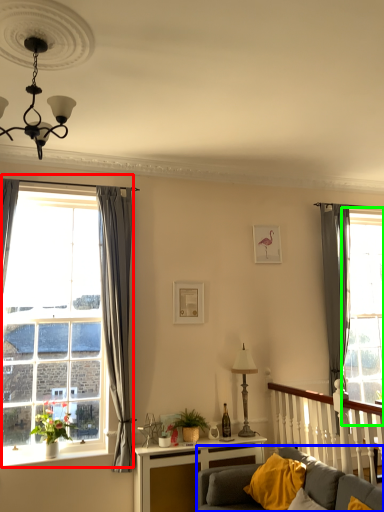
Question: Which object is positioned farthest from window (highlighted by a red box)? Select from studio couch (highlighted by a blue box) and glass door (highlighted by a green box).

Choices:
 (A) studio couch
 (B) glass door

Answer: (B)